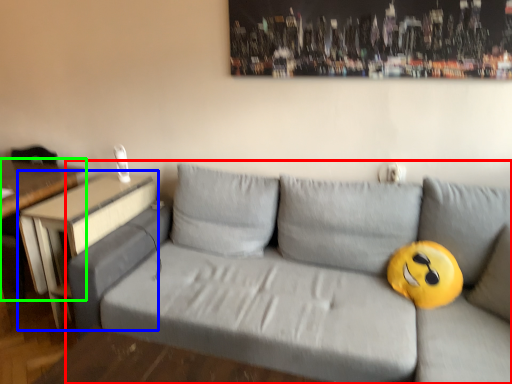
Question: Which object is positioned closest to studio couch (highlighted by a red box)? Select from table (highlighted by a blue box) and table (highlighted by a green box).

Choices:
 (A) table
 (B) table

Answer: (A)